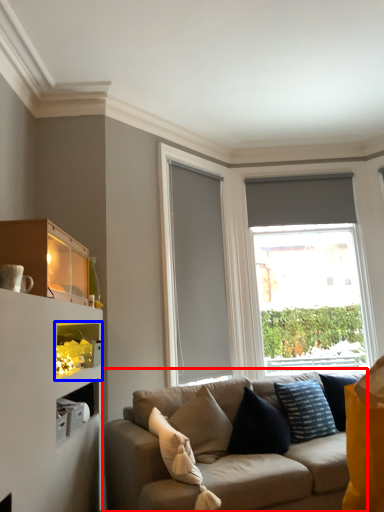
Question: Which object appears farthest to the camera in this image, studio couch (highlighted by a red box) or cabinet (highlighted by a blue box)?

Choices:
 (A) studio couch
 (B) cabinet

Answer: (B)